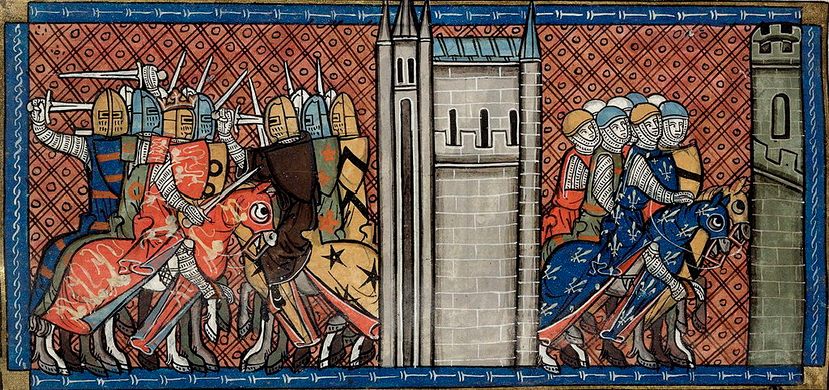
The image size is (829, 390). In order to click on wall in this screenshot , I will do `click(592, 59)`, `click(270, 51)`.